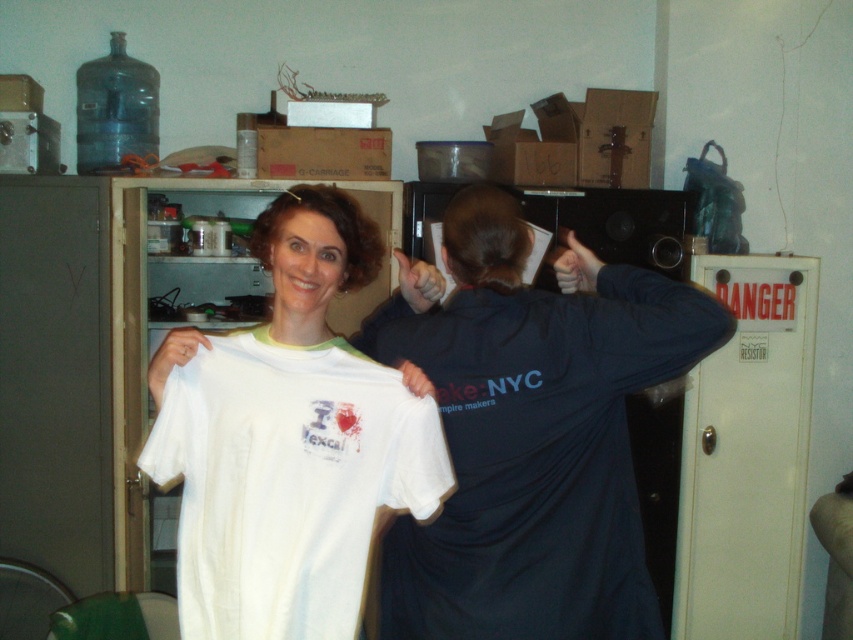
Question: Can you confirm if white matte t-shirt at center is positioned to the right of white cotton t-shirt at center?

Choices:
 (A) no
 (B) yes

Answer: (B)

Question: Can you confirm if white matte t-shirt at center is bigger than white cotton t-shirt at center?

Choices:
 (A) no
 (B) yes

Answer: (B)

Question: Which of the following is the closest to the observer?

Choices:
 (A) (614, 476)
 (B) (235, 548)

Answer: (B)

Question: Which of the following is the farthest from the observer?

Choices:
 (A) (486, 554)
 (B) (296, 568)

Answer: (A)

Question: In this image, where is white matte t-shirt at center located relative to white cotton t-shirt at center?

Choices:
 (A) left
 (B) right

Answer: (B)